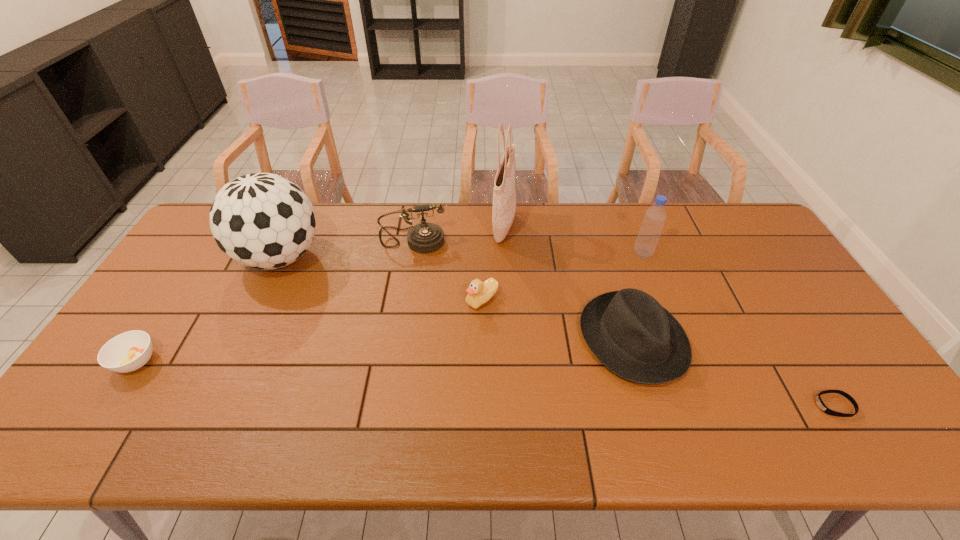
Identify the location of the rightmost object. (820, 403).

Find the location of `free location located 0.380m on the left of the tallest object`. free location located 0.380m on the left of the tallest object is located at coordinates (382, 227).

The width and height of the screenshot is (960, 540). In order to click on vacant space situated on the front of the seventh object from right to left in this screenshot , I will do `click(218, 390)`.

The width and height of the screenshot is (960, 540). I want to click on free point located on the back of the sixth shortest object, so 623,204.

At what (x,y) coordinates should I click in order to perform the action: click on vacant region located 0.210m on the right of the third object from left to right. Please return your answer as a coordinate pair (x, y). The width and height of the screenshot is (960, 540). Looking at the image, I should click on (508, 240).

I want to click on vacant space located on the right of the fedora, so click(x=766, y=340).

This screenshot has width=960, height=540. Find the location of `free space located 0.320m at the beak of the duck`. free space located 0.320m at the beak of the duck is located at coordinates (356, 300).

Identify the location of vacant space located 0.100m at the beak of the duck. This screenshot has width=960, height=540. (431, 300).

You are a GUI agent. You are given a task and a screenshot of the screen. Output one action in this format:
    pyautogui.click(x=<x>, y=<y>)
    Task: Click on the blank space located at the beak of the duck
    
    Given the screenshot: What is the action you would take?
    pyautogui.click(x=353, y=300)

Find the location of `vacant space located 0.170m on the right of the seventh tallest object`. vacant space located 0.170m on the right of the seventh tallest object is located at coordinates (224, 361).